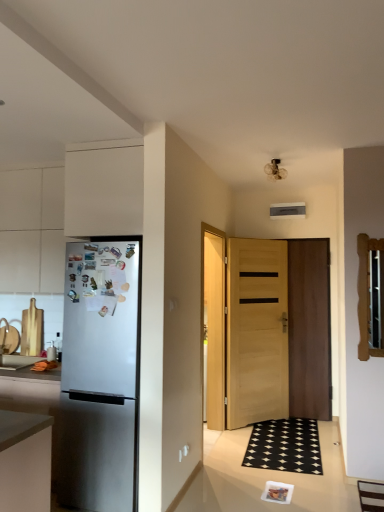
Question: Looking at the image, does matte gray countertop at left seem bigger or smaller compared to light brown wooden door at center, which is the first door in left-to-right order?

Choices:
 (A) small
 (B) big

Answer: (A)

Question: In the image, is matte gray countertop at left positioned in front of or behind light brown wooden door at center, positioned as the 2th door in right-to-left order?

Choices:
 (A) behind
 (B) front

Answer: (B)

Question: Estimate the real-world distances between objects in this image. Which object is farther from the white matte cabinet at left, acting as the second cabinetry starting from the front?

Choices:
 (A) matte gray countertop at left
 (B) light brown wooden door at center, which is the first door in left-to-right order
 (C) wooden door at center, the 2th door when ordered from left to right
 (D) satin silver refrigerator at left
 (E) white matte cabinet at upper left, the 1th cabinetry from the front

Answer: (C)

Question: Which object is positioned closest to the wooden door at center, the 2th door when ordered from left to right?

Choices:
 (A) satin silver refrigerator at left
 (B) light brown wooden door at center, positioned as the 2th door in right-to-left order
 (C) matte gray countertop at left
 (D) white matte cabinet at upper left, the 1th cabinetry from the front
 (E) white matte cabinet at left, placed as the first cabinetry when sorted from back to front

Answer: (B)